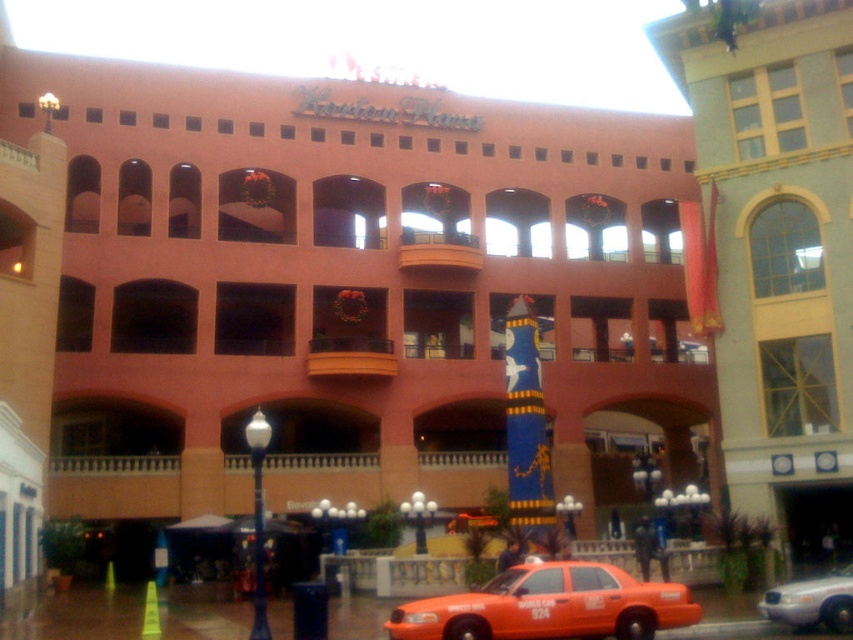
You are a photographer wanting to capture both the yellow textured building at right and the orange matte taxi at lower center in a single frame. Given their sizes, which object should you position closer to the camera to ensure both are visible clearly?

Since the yellow textured building at right is larger than the orange matte taxi at lower center, you should position the orange matte taxi at lower center closer to the camera to balance their sizes in the frame.

You are a pedestrian standing at the edge of Houston Plaza. You see the yellow textured building at right and the orange matte taxi at lower center. Which object is positioned higher in the scene?

The yellow textured building at right is positioned higher than the orange matte taxi at lower center because it is located above it in the scene.